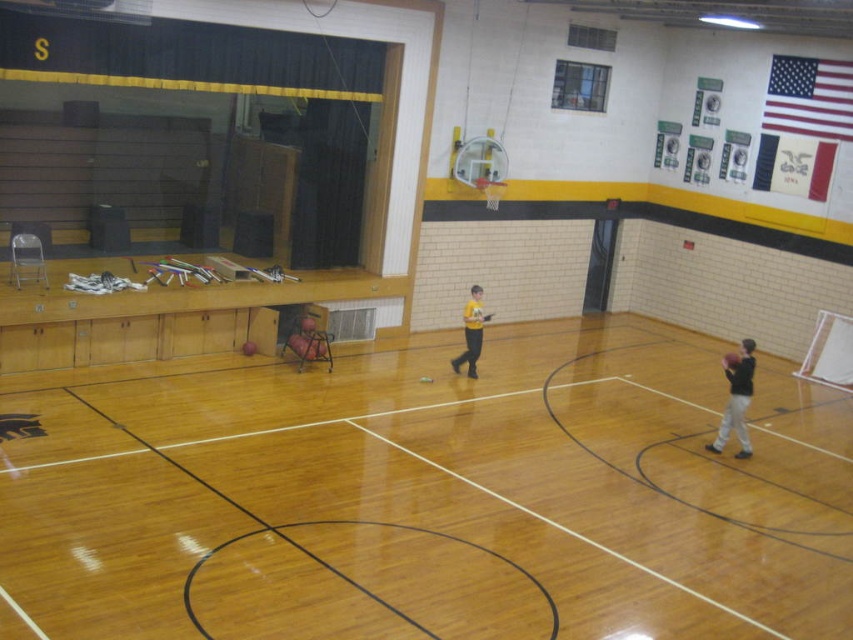
Question: Which point appears farthest from the camera in this image?

Choices:
 (A) (741, 349)
 (B) (473, 310)

Answer: (B)

Question: Can you confirm if matte black basketball at right is positioned to the left of yellow matte shirt at center?

Choices:
 (A) no
 (B) yes

Answer: (A)

Question: Is matte black basketball at right positioned in front of yellow matte shirt at center?

Choices:
 (A) yes
 (B) no

Answer: (A)

Question: Does matte black basketball at right appear on the left side of yellow matte shirt at center?

Choices:
 (A) yes
 (B) no

Answer: (B)